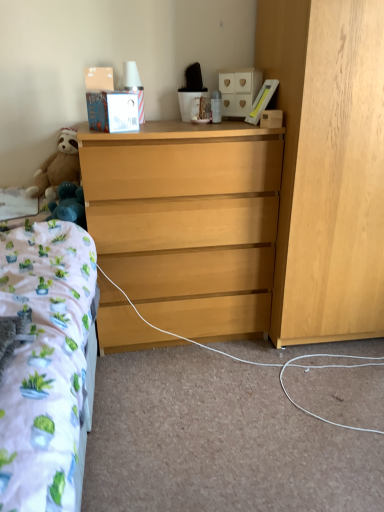
Question: Are light wood dresser at right, the 2th cabinetry in the left-to-right sequence, and white matte cabinet at upper center, which appears as the second cabinetry when ordered from the bottom, beside each other?

Choices:
 (A) yes
 (B) no

Answer: (B)

Question: From the image's perspective, does light wood dresser at right, which is the 1th cabinetry from bottom to top, appear lower than white matte cabinet at upper center, the 2th cabinetry from the right?

Choices:
 (A) no
 (B) yes

Answer: (B)

Question: From the image's perspective, does light wood dresser at right, which is the first cabinetry from right to left, appear higher than white matte cabinet at upper center, the 2th cabinetry from the right?

Choices:
 (A) no
 (B) yes

Answer: (A)

Question: Considering the relative sizes of light wood dresser at right, which is the first cabinetry from right to left, and white matte cabinet at upper center, the 2th cabinetry from the right, in the image provided, is light wood dresser at right, which is the first cabinetry from right to left, bigger than white matte cabinet at upper center, the 2th cabinetry from the right,?

Choices:
 (A) no
 (B) yes

Answer: (B)

Question: Would you say white matte cabinet at upper center, the first cabinetry when ordered from left to right, is part of light wood dresser at right, which is the first cabinetry from right to left,'s contents?

Choices:
 (A) yes
 (B) no

Answer: (B)

Question: Is light wood dresser at right, which is the 1th cabinetry from bottom to top, looking in the opposite direction of white matte cabinet at upper center, the first cabinetry when ordered from left to right?

Choices:
 (A) no
 (B) yes

Answer: (A)

Question: Does light wood dresser at right, the 2th cabinetry in the left-to-right sequence, come behind light wood dresser at center?

Choices:
 (A) yes
 (B) no

Answer: (B)

Question: Is light wood dresser at right, which is the 1th cabinetry from bottom to top, placed right next to light wood dresser at center?

Choices:
 (A) no
 (B) yes

Answer: (A)

Question: Does light wood dresser at right, the 2th cabinetry in the left-to-right sequence, lie in front of light wood dresser at center?

Choices:
 (A) no
 (B) yes

Answer: (B)

Question: Could you tell me if light wood dresser at right, the 2th cabinetry from the top, is facing light wood dresser at center?

Choices:
 (A) no
 (B) yes

Answer: (A)

Question: Does light wood dresser at right, the 2th cabinetry from the top, have a lesser width compared to light wood dresser at center?

Choices:
 (A) yes
 (B) no

Answer: (B)

Question: Is light wood dresser at right, the 2th cabinetry from the top, at the right side of light wood dresser at center?

Choices:
 (A) yes
 (B) no

Answer: (A)

Question: From the image's perspective, is light wood dresser at center beneath wooden box at upper right?

Choices:
 (A) yes
 (B) no

Answer: (A)